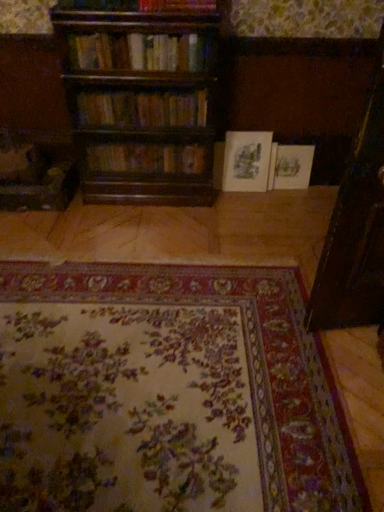
Find the location of a particular element. This screenshot has height=512, width=384. vacant point above wooden bookshelf at upper center, the first book from the front (from a real-world perspective) is located at coordinates tap(147, 29).